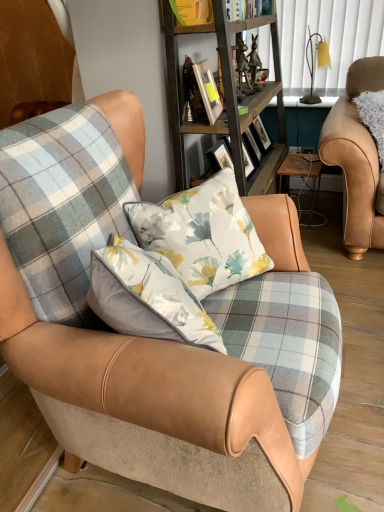
Question: In which direction should I rotate to look at plaid fabric chair at center, marked as the second chair in a right-to-left arrangement?

Choices:
 (A) left
 (B) right

Answer: (A)

Question: Does matte yellow lampshade at upper right turn towards wooden shelf at center?

Choices:
 (A) no
 (B) yes

Answer: (A)

Question: Is matte yellow lampshade at upper right turned away from wooden shelf at center?

Choices:
 (A) yes
 (B) no

Answer: (B)

Question: Is matte yellow lampshade at upper right positioned beyond the bounds of wooden shelf at center?

Choices:
 (A) no
 (B) yes

Answer: (B)

Question: From the image's perspective, is matte yellow lampshade at upper right under wooden shelf at center?

Choices:
 (A) yes
 (B) no

Answer: (B)

Question: Can you confirm if matte yellow lampshade at upper right is thinner than wooden shelf at center?

Choices:
 (A) no
 (B) yes

Answer: (B)

Question: Is matte yellow lampshade at upper right directly adjacent to wooden shelf at center?

Choices:
 (A) no
 (B) yes

Answer: (A)

Question: Is wooden shelf at center positioned far away from leather armchair at right, arranged as the second chair when viewed from the left?

Choices:
 (A) no
 (B) yes

Answer: (A)

Question: Is wooden shelf at center further to the viewer compared to leather armchair at right, arranged as the second chair when viewed from the left?

Choices:
 (A) no
 (B) yes

Answer: (A)

Question: Can you see wooden shelf at center touching leather armchair at right, placed as the first chair when sorted from back to front?

Choices:
 (A) yes
 (B) no

Answer: (B)

Question: From the image's perspective, is wooden shelf at center below leather armchair at right, placed as the first chair when sorted from back to front?

Choices:
 (A) no
 (B) yes

Answer: (A)

Question: Considering the relative positions of wooden shelf at center and leather armchair at right, placed as the second chair when sorted from front to back, in the image provided, is wooden shelf at center to the right of leather armchair at right, placed as the second chair when sorted from front to back, from the viewer's perspective?

Choices:
 (A) yes
 (B) no

Answer: (B)

Question: Does wooden shelf at center have a larger size compared to leather armchair at right, arranged as the second chair when viewed from the left?

Choices:
 (A) yes
 (B) no

Answer: (A)

Question: From the image's perspective, would you say plaid fabric chair at center, the 2th chair viewed from the back, is shown under metallic silver picture frame at upper center?

Choices:
 (A) yes
 (B) no

Answer: (A)